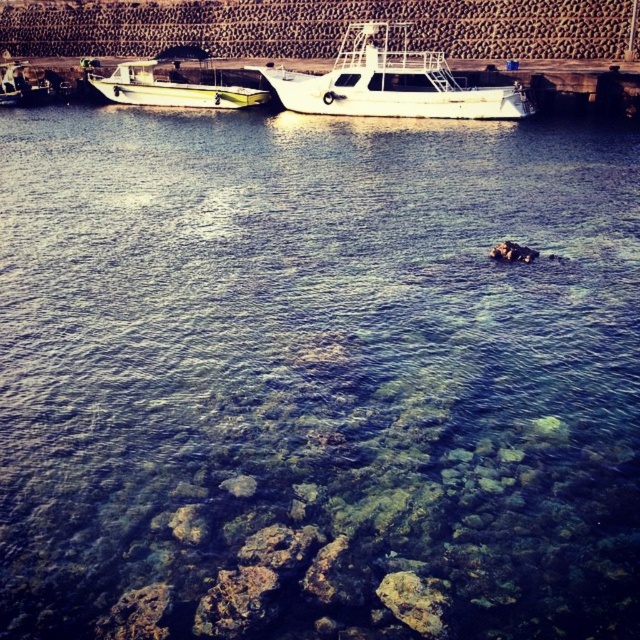
You are a marine biologist planning to use a boat to collect water samples. You have a choice between the metallic silver boat at left and the white matte boat at upper left. Which boat has a greater width, and why?

The metallic silver boat at left has a greater width than the white matte boat at upper left because the metallic silver boat at left is described as being larger in width according to the objects description.

You are standing on the wooden pier and want to board the metallic silver boat at left. Given that the point representing the boat is at coordinates (20, 86), is the boat located to your left or right side?

The metallic silver boat at left is represented by point (20, 86), so the boat is located to your left side.

You are standing at the center of the wooden pier and want to board the green matte boat at left. Which direction should you walk to reach it?

You should walk to the left from the center of the wooden pier to reach the green matte boat at left since it is positioned at point 0.141 on the x axis, which is to the left of the center.